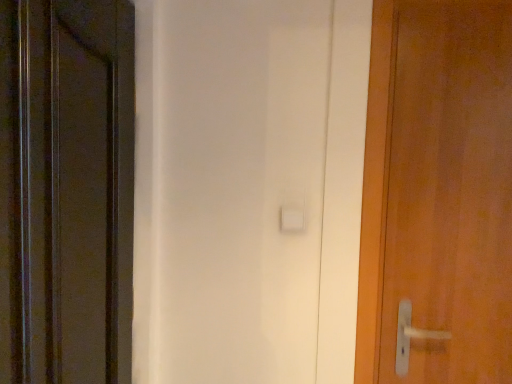
How much space does wooden door at right, which appears as the 1th door when viewed from the right, occupy horizontally?

wooden door at right, which appears as the 1th door when viewed from the right, is 0.89 inches wide.

What do you see at coordinates (438, 190) in the screenshot? I see `wooden door at right, which appears as the 1th door when viewed from the right` at bounding box center [438, 190].

Locate an element on the screen. wooden door at right, which appears as the 1th door when viewed from the right is located at coordinates (438, 190).

This screenshot has height=384, width=512. Describe the element at coordinates (66, 191) in the screenshot. I see `matte black door at left, arranged as the 2th door when viewed from the right` at that location.

At what (x,y) coordinates should I click in order to perform the action: click on matte black door at left, arranged as the 2th door when viewed from the right. Please return your answer as a coordinate pair (x, y). This screenshot has width=512, height=384. Looking at the image, I should click on tap(66, 191).

Where is `wooden door at right, which is the second door from left to right`? The image size is (512, 384). wooden door at right, which is the second door from left to right is located at coordinates (438, 190).

Which object is positioned more to the right, wooden door at right, which appears as the 1th door when viewed from the right, or matte black door at left, arranged as the 2th door when viewed from the right?

wooden door at right, which appears as the 1th door when viewed from the right.

Which object is further away from the camera taking this photo, wooden door at right, which is the second door from left to right, or matte black door at left, placed as the first door when sorted from left to right?

Positioned behind is wooden door at right, which is the second door from left to right.

Which is closer to the camera, (x=446, y=148) or (x=42, y=328)?

Point (x=446, y=148).

From the image's perspective, is wooden door at right, which is the second door from left to right, on matte black door at left, arranged as the 2th door when viewed from the right?

Indeed, from the image's perspective, wooden door at right, which is the second door from left to right, is shown above matte black door at left, arranged as the 2th door when viewed from the right.

From a real-world perspective, is wooden door at right, which is the second door from left to right, physically below matte black door at left, arranged as the 2th door when viewed from the right?

No, from a real-world perspective, wooden door at right, which is the second door from left to right, is not below matte black door at left, arranged as the 2th door when viewed from the right.

Is wooden door at right, which appears as the 1th door when viewed from the right, wider than matte black door at left, arranged as the 2th door when viewed from the right?

No, wooden door at right, which appears as the 1th door when viewed from the right, is not wider than matte black door at left, arranged as the 2th door when viewed from the right.

Is wooden door at right, which is the second door from left to right, taller or shorter than matte black door at left, placed as the first door when sorted from left to right?

Clearly, wooden door at right, which is the second door from left to right, is shorter compared to matte black door at left, placed as the first door when sorted from left to right.

Is wooden door at right, which appears as the 1th door when viewed from the right, bigger or smaller than matte black door at left, arranged as the 2th door when viewed from the right?

Clearly, wooden door at right, which appears as the 1th door when viewed from the right, is smaller in size than matte black door at left, arranged as the 2th door when viewed from the right.

Is wooden door at right, which appears as the 1th door when viewed from the right, inside the boundaries of matte black door at left, placed as the first door when sorted from left to right, or outside?

wooden door at right, which appears as the 1th door when viewed from the right, is not inside matte black door at left, placed as the first door when sorted from left to right, it's outside.

Does wooden door at right, which is the second door from left to right, touch matte black door at left, placed as the first door when sorted from left to right?

No, wooden door at right, which is the second door from left to right, is not making contact with matte black door at left, placed as the first door when sorted from left to right.

Could you tell me if wooden door at right, which appears as the 1th door when viewed from the right, is facing matte black door at left, placed as the first door when sorted from left to right?

No.

What's the angular difference between wooden door at right, which is the second door from left to right, and matte black door at left, placed as the first door when sorted from left to right,'s facing directions?

The angle between the facing direction of wooden door at right, which is the second door from left to right, and the facing direction of matte black door at left, placed as the first door when sorted from left to right, is 91.5 degrees.

At what (x,y) coordinates should I click in order to perform the action: click on door that is on the right side of matte black door at left, placed as the first door when sorted from left to right. Please return your answer as a coordinate pair (x, y). Looking at the image, I should click on (438, 190).

Which object is positioned more to the left, matte black door at left, placed as the first door when sorted from left to right, or wooden door at right, which appears as the 1th door when viewed from the right?

Result: matte black door at left, placed as the first door when sorted from left to right, is more to the left.

Does matte black door at left, arranged as the 2th door when viewed from the right, lie in front of wooden door at right, which is the second door from left to right?

Yes, the depth of matte black door at left, arranged as the 2th door when viewed from the right, is less than that of wooden door at right, which is the second door from left to right.

Does point (6, 301) come closer to viewer compared to point (418, 248)?

Yes, point (6, 301) is in front of point (418, 248).

From the image's perspective, is matte black door at left, arranged as the 2th door when viewed from the right, above wooden door at right, which appears as the 1th door when viewed from the right?

Incorrect, from the image's perspective, matte black door at left, arranged as the 2th door when viewed from the right, is lower than wooden door at right, which appears as the 1th door when viewed from the right.

From a real-world perspective, is matte black door at left, placed as the first door when sorted from left to right, positioned over wooden door at right, which is the second door from left to right, based on gravity?

No, from a real-world perspective, matte black door at left, placed as the first door when sorted from left to right, is not above wooden door at right, which is the second door from left to right.

Between matte black door at left, arranged as the 2th door when viewed from the right, and wooden door at right, which is the second door from left to right, which one has larger width?

matte black door at left, arranged as the 2th door when viewed from the right, is wider.

Does matte black door at left, placed as the first door when sorted from left to right, have a greater height compared to wooden door at right, which is the second door from left to right?

Yes, matte black door at left, placed as the first door when sorted from left to right, is taller than wooden door at right, which is the second door from left to right.

Which of these two, matte black door at left, placed as the first door when sorted from left to right, or wooden door at right, which appears as the 1th door when viewed from the right, is bigger?

matte black door at left, placed as the first door when sorted from left to right.

Is matte black door at left, placed as the first door when sorted from left to right, located outside wooden door at right, which is the second door from left to right?

matte black door at left, placed as the first door when sorted from left to right, is positioned outside wooden door at right, which is the second door from left to right.

Is there a large distance between matte black door at left, arranged as the 2th door when viewed from the right, and wooden door at right, which appears as the 1th door when viewed from the right?

No, there isn't a large distance between matte black door at left, arranged as the 2th door when viewed from the right, and wooden door at right, which appears as the 1th door when viewed from the right.

Is matte black door at left, placed as the first door when sorted from left to right, aimed at wooden door at right, which appears as the 1th door when viewed from the right?

Yes, matte black door at left, placed as the first door when sorted from left to right, faces towards wooden door at right, which appears as the 1th door when viewed from the right.

Can you tell me how much matte black door at left, arranged as the 2th door when viewed from the right, and wooden door at right, which is the second door from left to right, differ in facing direction?

They differ by 91.5 degrees in their facing directions.

Locate an element on the screen. The image size is (512, 384). door lying on the right of matte black door at left, arranged as the 2th door when viewed from the right is located at coordinates (438, 190).

Image resolution: width=512 pixels, height=384 pixels. I want to click on door lying above the matte black door at left, arranged as the 2th door when viewed from the right (from the image's perspective), so click(438, 190).

There is a matte black door at left, placed as the first door when sorted from left to right. In order to click on door above it (from a real-world perspective) in this screenshot , I will do `click(438, 190)`.